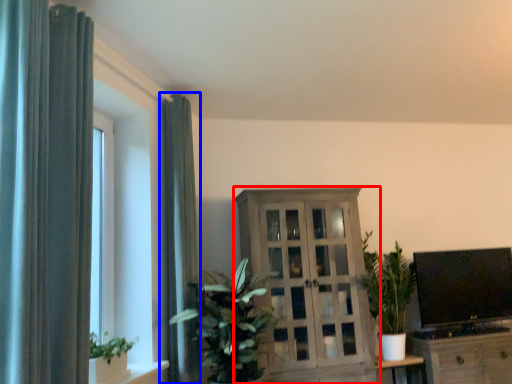
Question: Which point is further to the camera, cabinetry (highlighted by a red box) or curtain (highlighted by a blue box)?

Choices:
 (A) cabinetry
 (B) curtain

Answer: (A)